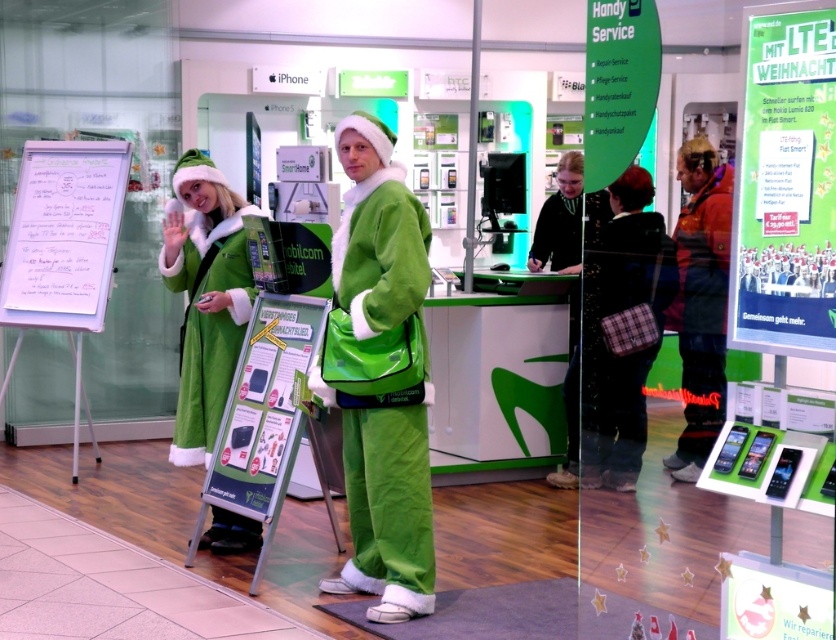
You are a customer in the mobile phone store and want to locate the white paperboard at center. What are its coordinates in the store?

The white paperboard at center is located at coordinates point (x=64, y=234).